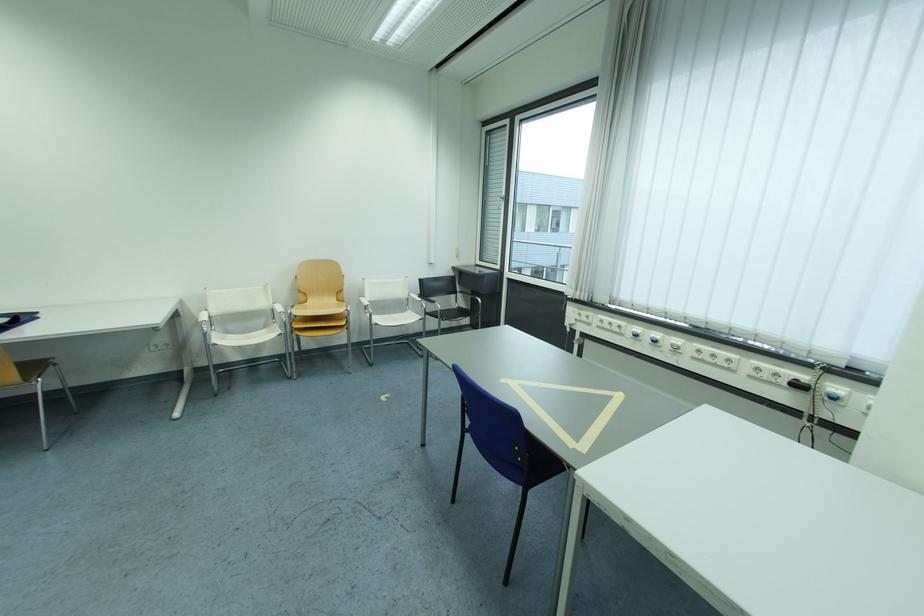
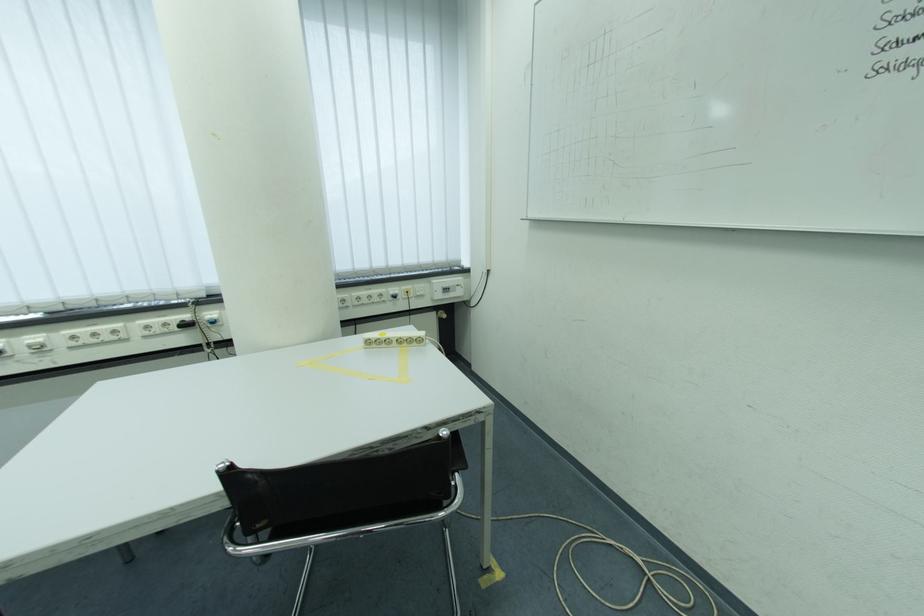
Locate, in the second image, the point that corresponds to (845,390) in the first image.

(217, 315)